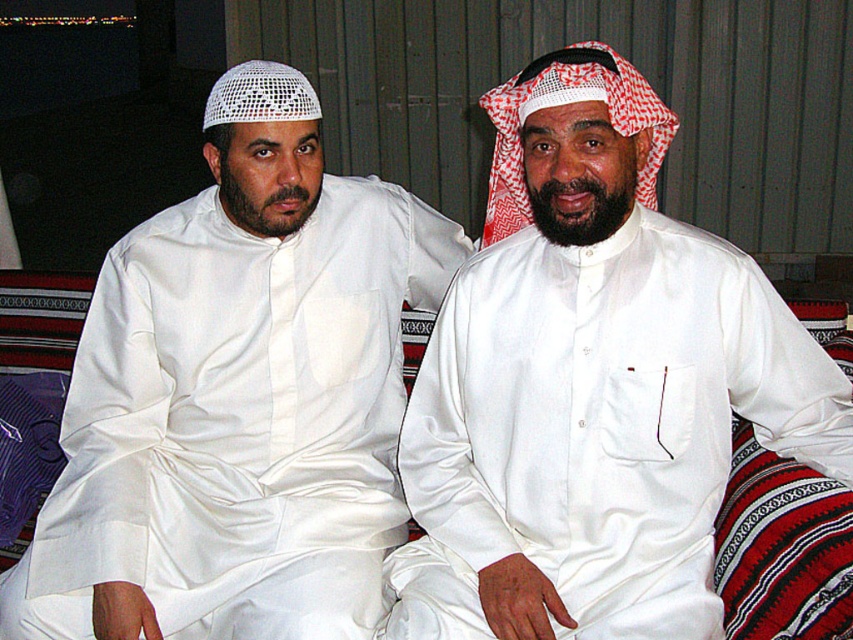
Question: In this image, where is white satin kandura at center located relative to white satin kandura at left?

Choices:
 (A) below
 (B) above

Answer: (B)

Question: Which of the following is the closest to the observer?

Choices:
 (A) (323, 349)
 (B) (706, 589)

Answer: (B)

Question: Is white satin kandura at center smaller than white satin kandura at left?

Choices:
 (A) yes
 (B) no

Answer: (A)

Question: Does white satin kandura at center come in front of white satin kandura at left?

Choices:
 (A) no
 (B) yes

Answer: (B)